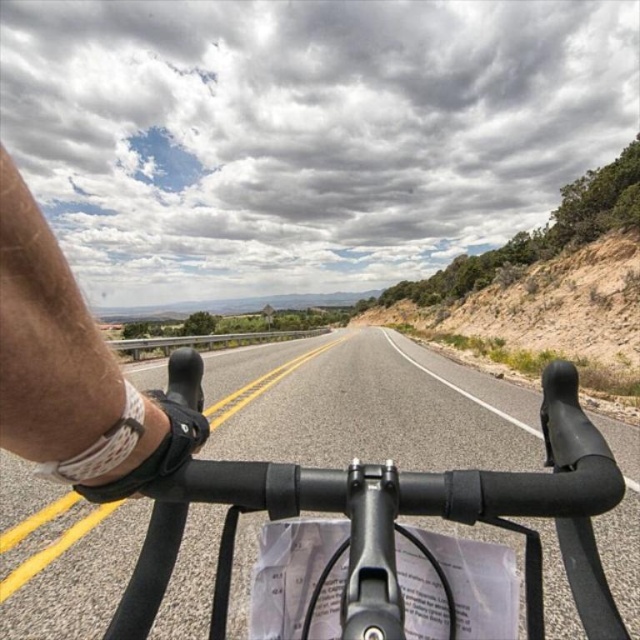
Question: Which of the following is the farthest from the observer?

Choices:
 (A) (198, 625)
 (B) (124, 486)

Answer: (A)

Question: Which of the following is the farthest from the observer?

Choices:
 (A) skinny white bandage at left
 (B) black matte bicycle handlebars at center

Answer: (B)

Question: Can you confirm if black matte bicycle handlebars at center is bigger than skinny white bandage at left?

Choices:
 (A) no
 (B) yes

Answer: (B)

Question: Is black matte bicycle handlebars at center thinner than skinny white bandage at left?

Choices:
 (A) no
 (B) yes

Answer: (A)

Question: Does black matte bicycle handlebars at center have a smaller size compared to skinny white bandage at left?

Choices:
 (A) yes
 (B) no

Answer: (B)